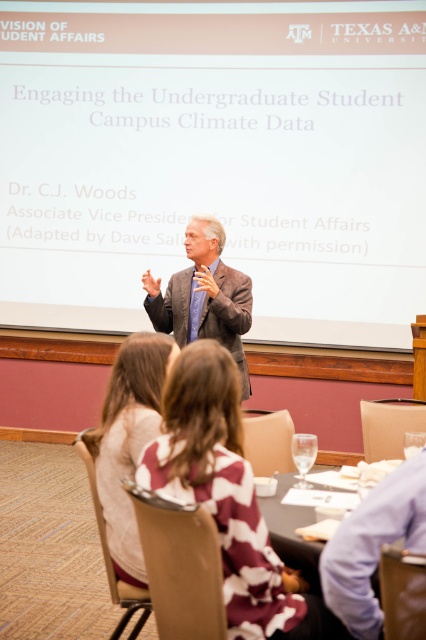
Is maroon and white patterned sweater at center positioned before light brown suit at center?

Yes, maroon and white patterned sweater at center is in front of light brown suit at center.

Who is more distant from viewer, (195, 428) or (230, 294)?

Point (230, 294)

Between point (218, 356) and point (146, 288), which one is positioned in front?

Point (218, 356)

The width and height of the screenshot is (426, 640). I want to click on maroon and white patterned sweater at center, so pos(226,493).

How far apart are maroon and white patterned sweater at center and translucent glass table at center?

They are 40.76 centimeters apart.

Is point (287, 620) positioned before point (270, 497)?

Yes.

Does point (311, 602) come in front of point (334, 468)?

Yes, point (311, 602) is in front of point (334, 468).

Locate an element on the screen. This screenshot has height=640, width=426. maroon and white patterned sweater at center is located at coordinates (226, 493).

Is camouflage fabric jacket at lower center further to the viewer compared to translucent glass table at center?

Yes, camouflage fabric jacket at lower center is further from the viewer.

Does camouflage fabric jacket at lower center appear on the right side of translucent glass table at center?

Incorrect, camouflage fabric jacket at lower center is not on the right side of translucent glass table at center.

Who is more distant from viewer, (154, 349) or (268, 522)?

The point (154, 349) is more distant.

This screenshot has width=426, height=640. In order to click on camouflage fabric jacket at lower center in this screenshot , I will do `click(129, 440)`.